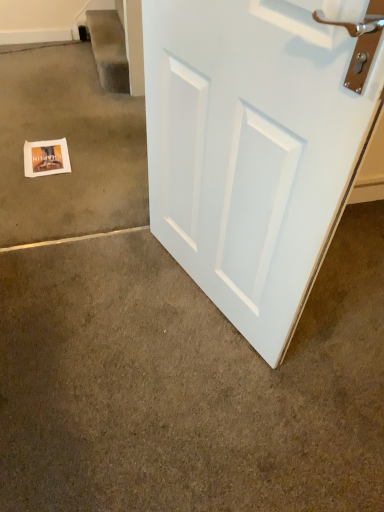
Question: Could white matte door at center, placed as the 1th concrete when sorted from front to back, be considered to be inside white matte door at right?

Choices:
 (A) yes
 (B) no

Answer: (B)

Question: Is white matte door at right taller than white matte door at center, placed as the 1th concrete when sorted from front to back?

Choices:
 (A) yes
 (B) no

Answer: (A)

Question: Considering the relative sizes of white matte door at right and white matte door at center, which ranks as the first concrete in bottom-to-top order, in the image provided, is white matte door at right smaller than white matte door at center, which ranks as the first concrete in bottom-to-top order,?

Choices:
 (A) yes
 (B) no

Answer: (B)

Question: Does white matte door at right have a lesser width compared to white matte door at center, placed as the 1th concrete when sorted from front to back?

Choices:
 (A) no
 (B) yes

Answer: (B)

Question: Is white matte door at right beside white matte door at center, arranged as the second concrete when viewed from the top?

Choices:
 (A) yes
 (B) no

Answer: (B)

Question: Does point (97, 49) appear closer or farther from the camera than point (64, 170)?

Choices:
 (A) closer
 (B) farther

Answer: (B)

Question: Considering their positions, is carpeted stairwell at upper left located in front of or behind matte paper postcard at lower left?

Choices:
 (A) front
 (B) behind

Answer: (B)

Question: Is carpeted stairwell at upper left bigger or smaller than matte paper postcard at lower left?

Choices:
 (A) small
 (B) big

Answer: (B)

Question: Would you say carpeted stairwell at upper left is to the left or to the right of matte paper postcard at lower left in the picture?

Choices:
 (A) right
 (B) left

Answer: (A)

Question: Based on their sizes in the image, would you say white matte door at center, which ranks as the first concrete in bottom-to-top order, is bigger or smaller than white matte door at right?

Choices:
 (A) big
 (B) small

Answer: (B)

Question: From the image's perspective, is white matte door at center, which is counted as the 2th concrete, starting from the back, located above or below white matte door at right?

Choices:
 (A) below
 (B) above

Answer: (A)

Question: From a real-world perspective, is white matte door at center, arranged as the second concrete when viewed from the top, positioned above or below white matte door at right?

Choices:
 (A) above
 (B) below

Answer: (B)

Question: Considering the positions of white matte door at center, placed as the 1th concrete when sorted from front to back, and white matte door at right in the image, is white matte door at center, placed as the 1th concrete when sorted from front to back, wider or thinner than white matte door at right?

Choices:
 (A) wide
 (B) thin

Answer: (A)

Question: Relative to white paper at lower left, which appears as the 2th concrete when viewed from the front, is white matte door at center, which ranks as the first concrete in bottom-to-top order, in front or behind?

Choices:
 (A) front
 (B) behind

Answer: (A)

Question: Is point (266, 444) positioned closer to the camera than point (89, 74)?

Choices:
 (A) farther
 (B) closer

Answer: (B)